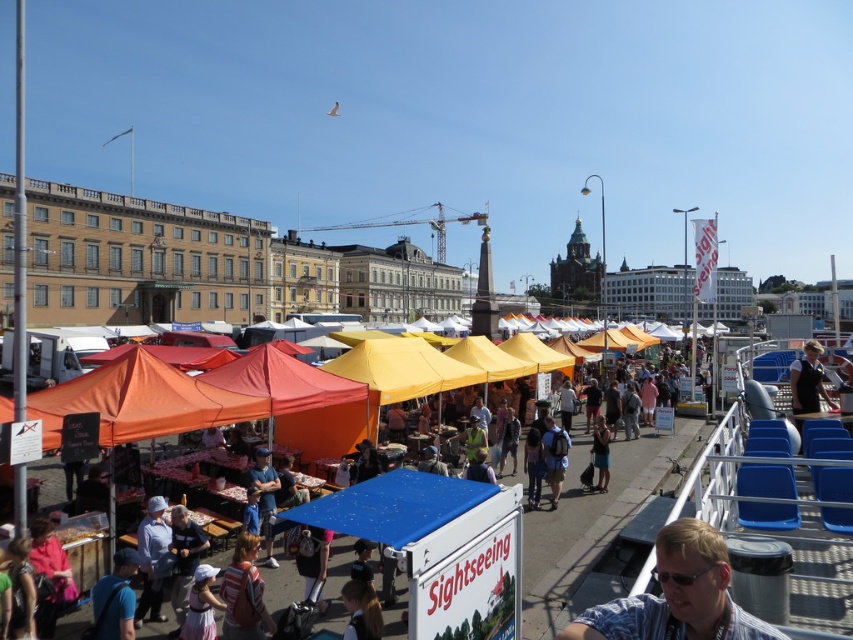
You are standing at the edge of the market and want to reach the light brown leather backpack at lower center. Is the orange fabric market at lower left blocking your path?

The orange fabric market at lower left is in front of the light brown leather backpack at lower center, so it is blocking the path to the light brown leather backpack at lower center.

You are a photographer standing at the edge of the market, and you want to take a photo of the light brown leather backpack at lower center and the denim jacket at center. Which object is closer to the camera?

The light brown leather backpack at lower center is shorter than the denim jacket at center, so the denim jacket at center is closer to the camera.